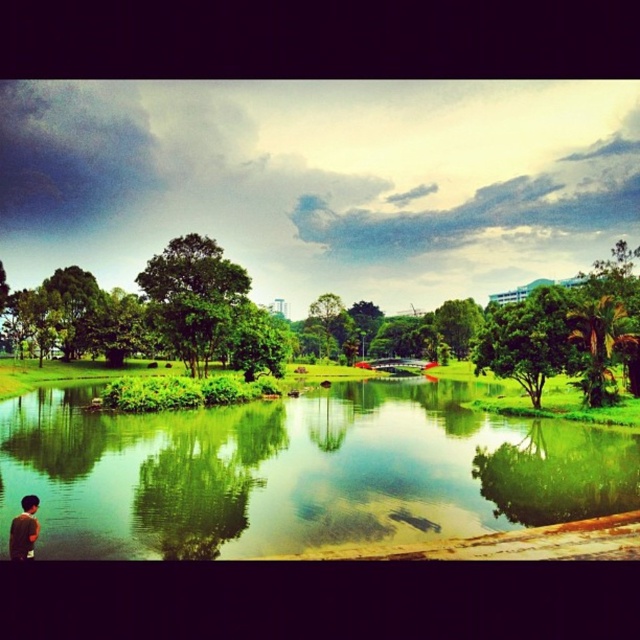
Is point (257, 449) positioned before point (1, 349)?

That is True.

Is the position of green reflective water at lower left more distant than that of green leafy tree at left?

That is False.

Is point (316, 481) less distant than point (3, 276)?

Yes.

This screenshot has width=640, height=640. Find the location of `green reflective water at lower left`. green reflective water at lower left is located at coordinates (300, 472).

Which is below, green leafy tree at center or green matte shirt at lower left?

green matte shirt at lower left

How far apart are green leafy tree at center and green matte shirt at lower left?

green leafy tree at center is 47.77 meters away from green matte shirt at lower left.

Does point (154, 284) come behind point (22, 548)?

That is True.

In order to click on green leafy tree at center in this screenshot , I will do `click(193, 294)`.

Does green reflective water at lower left have a lesser width compared to green leafy tree at center?

No.

Identify the location of green reflective water at lower left. The width and height of the screenshot is (640, 640). (300, 472).

Does point (1, 442) come closer to viewer compared to point (168, 337)?

Yes, it is in front of point (168, 337).

I want to click on green reflective water at lower left, so click(300, 472).